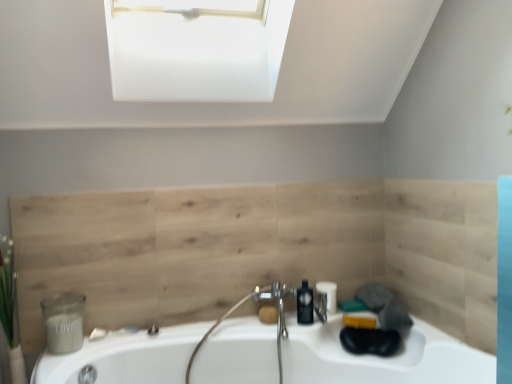
At what (x,y) coordinates should I click in order to perform the action: click on vacant area on top of natural wood paneling at center (from a real-world perspective). Please return your answer as a coordinate pair (x, y). The image size is (512, 384). Looking at the image, I should click on (214, 182).